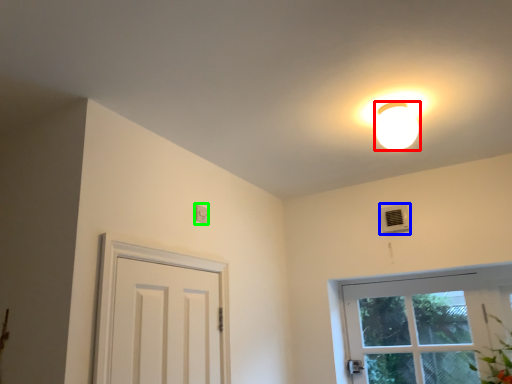
Question: Based on their relative distances, which object is nearer to lamp (highlighted by a red box)? Choose from air conditioner (highlighted by a blue box) and light switch (highlighted by a green box).

Choices:
 (A) air conditioner
 (B) light switch

Answer: (A)